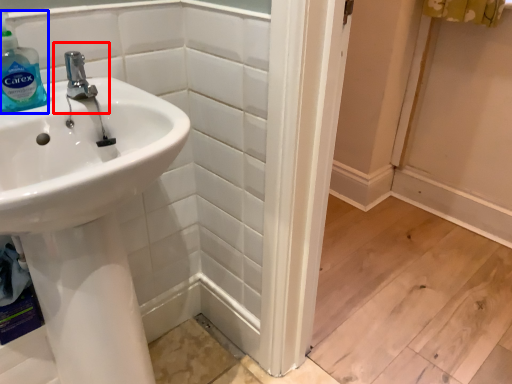
Question: Which object appears closest to the camera in this image, plumbing fixture (highlighted by a red box) or cleaning product (highlighted by a blue box)?

Choices:
 (A) plumbing fixture
 (B) cleaning product

Answer: (B)